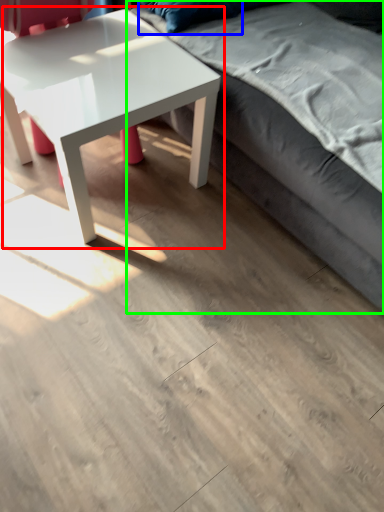
Question: Which object is positioned closest to coffee table (highlighted by a red box)? Select from pillow (highlighted by a blue box) and studio couch (highlighted by a green box).

Choices:
 (A) pillow
 (B) studio couch

Answer: (B)